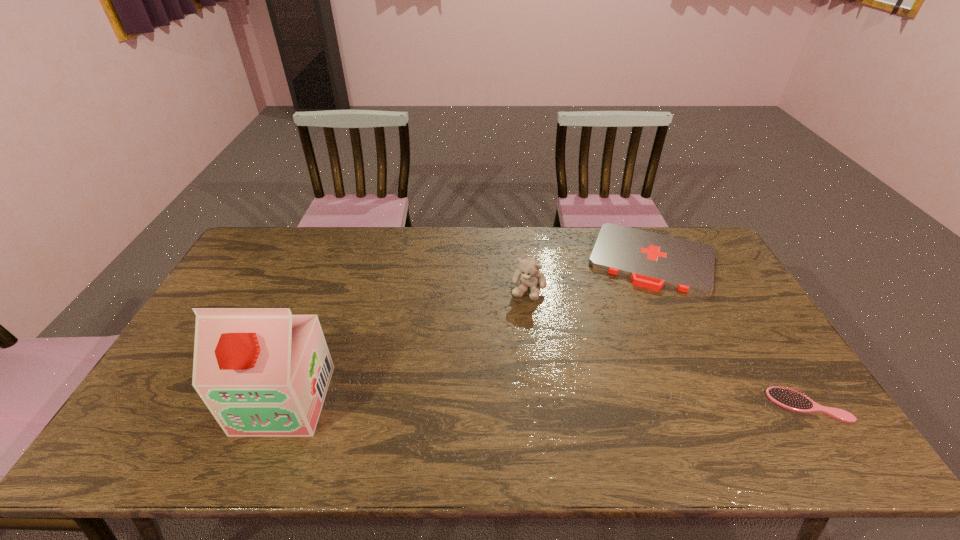
Where is `free spot at the far edge of the desktop`? free spot at the far edge of the desktop is located at coordinates (516, 227).

In the image, there is a desktop. Identify the location of vacant space at the near edge. The width and height of the screenshot is (960, 540). (557, 409).

The image size is (960, 540). I want to click on vacant space at the right edge of the desktop, so click(x=751, y=343).

This screenshot has width=960, height=540. In the image, there is a desktop. What are the coordinates of `vacant area at the far right corner` in the screenshot? It's located at (687, 227).

Find the location of a particular element. This screenshot has width=960, height=540. empty space that is in between the third object from right to left and the first-aid kit is located at coordinates (589, 274).

At what (x,y) coordinates should I click in order to perform the action: click on empty location between the soya milk and the hairbrush. Please return your answer as a coordinate pair (x, y). The width and height of the screenshot is (960, 540). Looking at the image, I should click on (546, 402).

The width and height of the screenshot is (960, 540). I want to click on free space between the leftmost object and the hairbrush, so click(x=546, y=402).

You are a GUI agent. You are given a task and a screenshot of the screen. Output one action in this format:
    pyautogui.click(x=<x>, y=<y>)
    Task: Click on the free spot between the second tallest object and the first-aid kit
    This screenshot has height=540, width=960.
    Given the screenshot: What is the action you would take?
    pyautogui.click(x=589, y=274)

Find the location of a particular element. The height and width of the screenshot is (540, 960). free spot between the leftmost object and the second object from left to right is located at coordinates (406, 345).

The height and width of the screenshot is (540, 960). I want to click on vacant space that is in between the leftmost object and the hairbrush, so click(x=546, y=402).